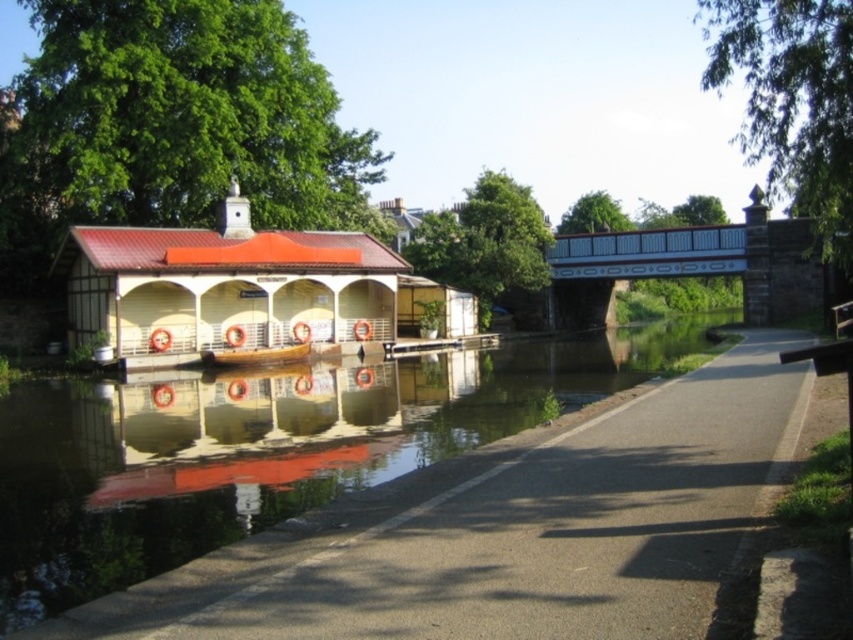
You are a landscape architect designing a new pathway that needs to be elevated above the smooth concrete river at center. The matte white hut at left must remain visible from the pathway. Can the pathway be built at the same height as the hut without blocking the view?

The smooth concrete river at center is not as tall as the matte white hut at left. Since the river is shorter in height, building the pathway at the same elevation as the hut would still allow the hut to be visible from the pathway, as its height would not obstruct the view.

You are a landscape architect designing a new pathway. You need to know which object, the smooth concrete river at center or the matte white hut at left, is wider to ensure proper alignment of the pathway. Which one is wider?

The smooth concrete river at center is wider than the matte white hut at left according to the description.